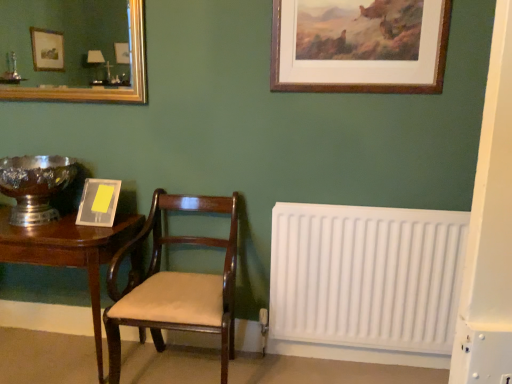
Question: Considering the relative positions of shiny silver bowl at left and white plastic radiator at lower right in the image provided, is shiny silver bowl at left to the left or to the right of white plastic radiator at lower right?

Choices:
 (A) right
 (B) left

Answer: (B)

Question: From their relative heights in the image, would you say shiny silver bowl at left is taller or shorter than white plastic radiator at lower right?

Choices:
 (A) short
 (B) tall

Answer: (A)

Question: Which of these objects is positioned closest to the wooden picture frame at upper center, the first picture frame positioned from the right?

Choices:
 (A) gold-framed mirror at upper left
 (B) mahogany wood table at left
 (C) matte gray picture frame at left, the first picture frame positioned from the bottom
 (D) shiny silver bowl at left
 (E) white plastic radiator at lower right

Answer: (E)

Question: Which is nearer to the white plastic radiator at lower right?

Choices:
 (A) shiny silver bowl at left
 (B) gold-framed mirror at upper left
 (C) matte gray picture frame at left, the second picture frame viewed from the right
 (D) wooden picture frame at upper center, arranged as the 2th picture frame when viewed from the left
 (E) mahogany wood chair at center

Answer: (E)